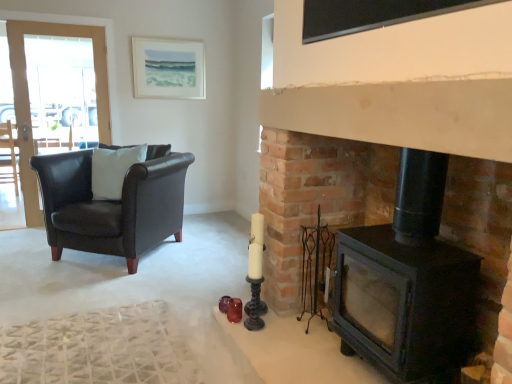
Question: In terms of size, does dark brown leather armchair at left, the second chair viewed from the right, appear bigger or smaller than black glass window screen at upper center?

Choices:
 (A) small
 (B) big

Answer: (B)

Question: Is point pyautogui.click(x=9, y=160) positioned closer to the camera than point pyautogui.click(x=388, y=11)?

Choices:
 (A) farther
 (B) closer

Answer: (A)

Question: Considering the real-world distances, which object is farthest from the black glass window screen at upper center?

Choices:
 (A) clear glass screen door at left
 (B) black matte fireplace at right
 (C) dark brown leather armchair at left, which is the first chair from back to front
 (D) white matte pillow at left
 (E) matte white picture frame at upper center

Answer: (C)

Question: Estimate the real-world distances between objects in this image. Which object is farther from the black matte fireplace at right?

Choices:
 (A) clear glass screen door at left
 (B) matte white picture frame at upper center
 (C) matte black leather armchair at left, the second chair in the left-to-right sequence
 (D) white matte pillow at left
 (E) black glass window screen at upper center

Answer: (A)